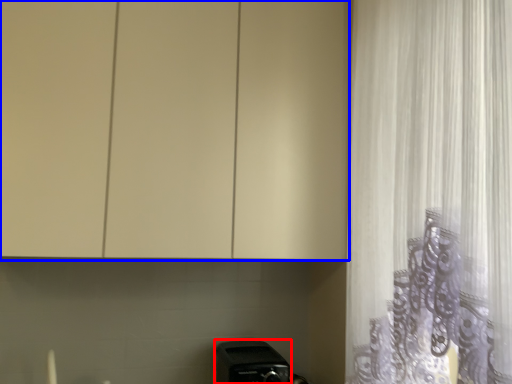
Question: Which object appears closest to the camera in this image, appliance (highlighted by a red box) or cabinetry (highlighted by a blue box)?

Choices:
 (A) appliance
 (B) cabinetry

Answer: (B)